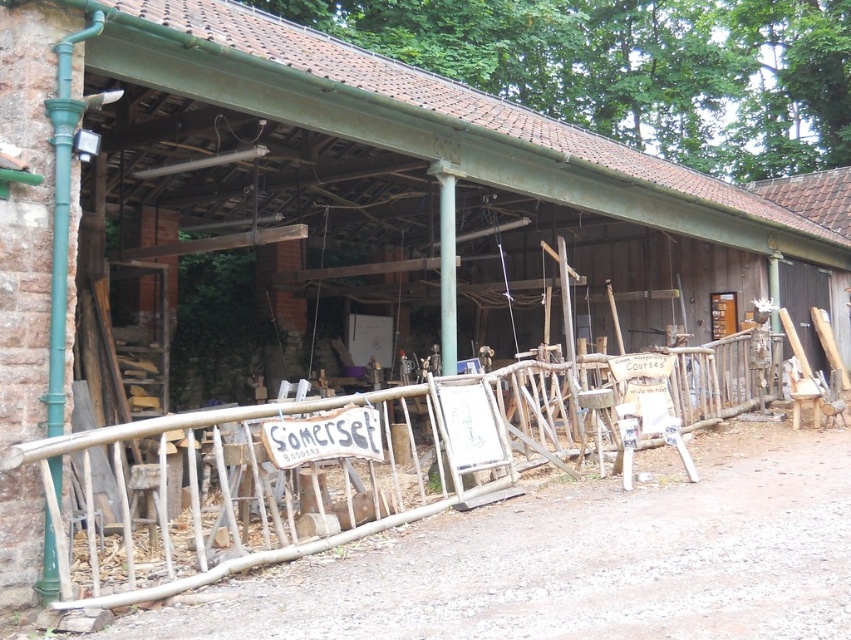
You are a visitor arriving at the Somerset workshop and see the wooden at center and the wooden signboard at center. Which object is bigger in size?

The wooden at center is larger in size than the wooden signboard at center.

You are standing in front of the Somerset workshop and want to determine the relative positions of two points marked on the railing. Which point is closer to you, point (127, 604) or point (372, 460)?

Point (127, 604) is closer to the viewer than point (372, 460).

You are standing in front of the Somerset workshop and want to pick up the wooden at center to move it closer to the wooden signboard at center. Which object is currently closer to you?

The wooden at center is closer to the viewer than the wooden signboard at center, so the wooden at center is currently closer to you.